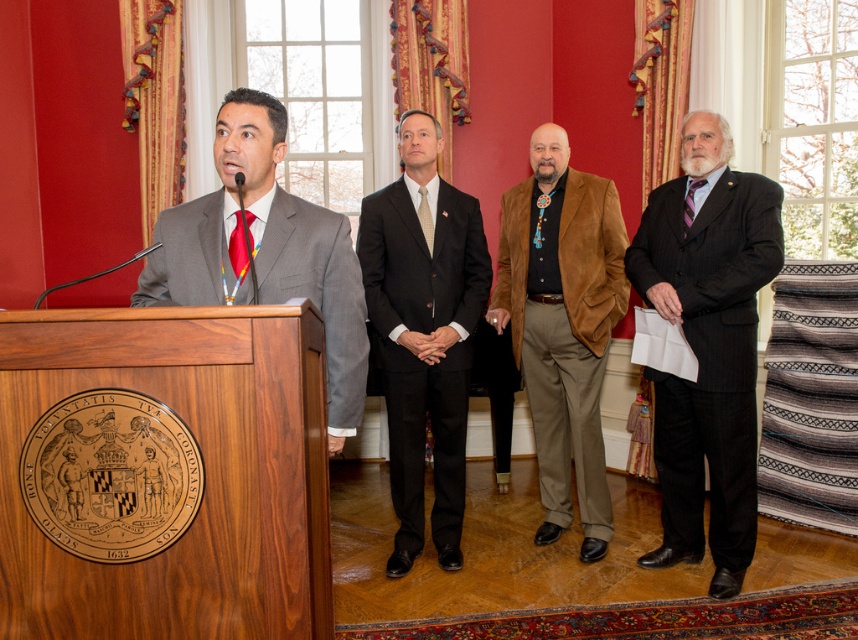
You are an event photographer positioned at the back of the room. You need to capture a clear photo of both the dark gray pinstripe suit at right and the shiny red tie at left. Which object will appear closer to you in the photo?

The dark gray pinstripe suit at right is further to the viewer than the shiny red tie at left, so the dark gray pinstripe suit at right will appear closer to you in the photo.

You are attending this formal event and want to take a photo of both the black suit at center and the suede jacket at center. Since you can only focus on one person at a time, which one should you aim your camera at first to ensure you capture both in the frame without moving the camera?

The black suit at center is to the left of the suede jacket at center, so you should aim your camera at the black suit at center first to ensure both are in the frame without moving the camera.